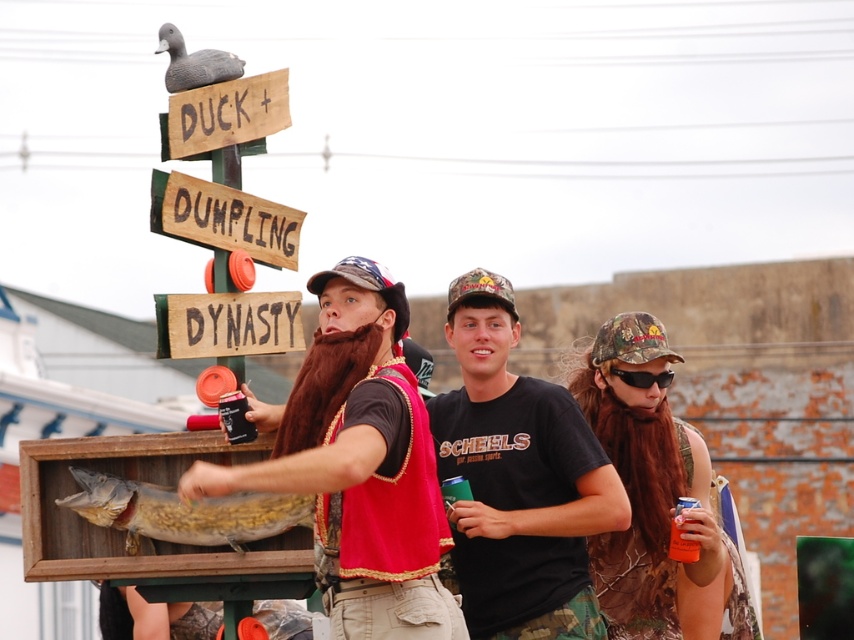
You are planning to hang a new decoration that requires knowing the height of the wooden sign at center and the matte gray duck at upper left. Which one is taller?

The wooden sign at center is taller than the matte gray duck at upper left.

Based on the photo, you are standing at the signpost and want to greet the person wearing the camouflage fabric baseball cap at right first. Which direction should you turn from the american flag fabric baseball cap at center to face them?

You should turn to your right from the american flag fabric baseball cap at center to face the camouflage fabric baseball cap at right, since the camouflage fabric baseball cap at right is located to the right of the american flag fabric baseball cap at center.

You are standing at the signpost and want to place a new sign between the two points, point (507, 566) and point (209, 64). Which point should the sign be closer to to ensure it is visible to someone approaching from the front?

The sign should be placed closer to point (209, 64) because it is further away from the viewer, ensuring visibility to those approaching from the front.